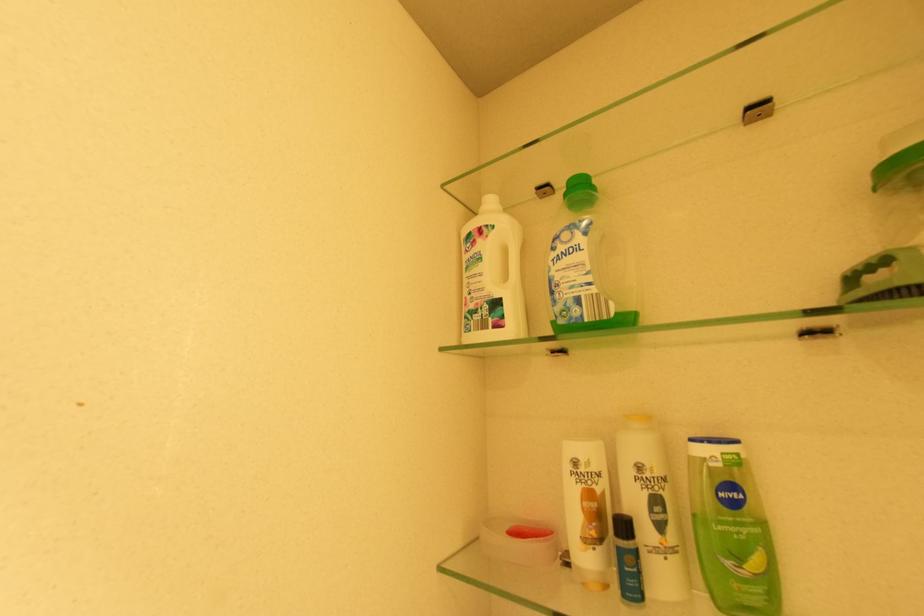
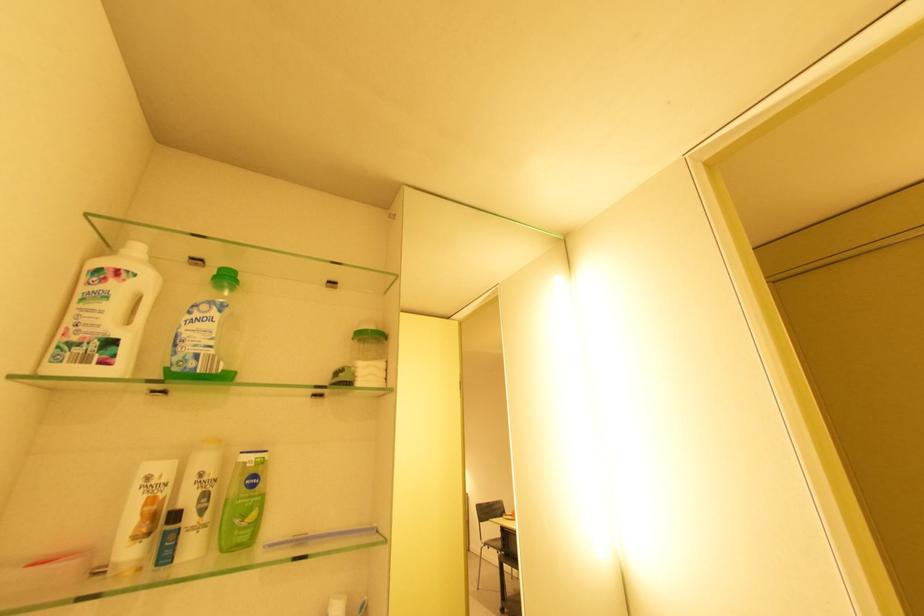
The point at [733,458] is marked in the first image. Where is the corresponding point in the second image?

(262, 460)